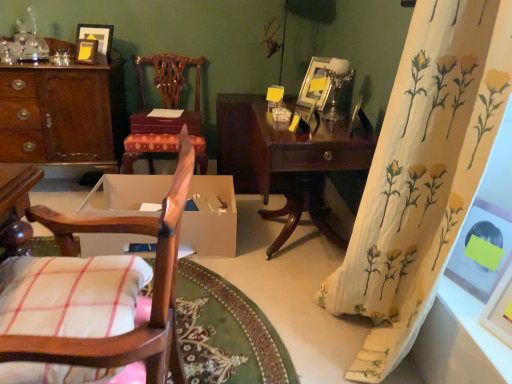
Question: Is metallic silver table lamp at upper right wider than white cotton pillow at lower left?

Choices:
 (A) no
 (B) yes

Answer: (A)

Question: Are metallic silver table lamp at upper right and white cotton pillow at lower left beside each other?

Choices:
 (A) yes
 (B) no

Answer: (B)

Question: Is metallic silver table lamp at upper right closer to the viewer compared to white cotton pillow at lower left?

Choices:
 (A) no
 (B) yes

Answer: (A)

Question: Is metallic silver table lamp at upper right outside white cotton pillow at lower left?

Choices:
 (A) no
 (B) yes

Answer: (B)

Question: Is metallic silver table lamp at upper right taller than white cotton pillow at lower left?

Choices:
 (A) no
 (B) yes

Answer: (B)

Question: From a real-world perspective, is metallic silver table lamp at upper right positioned over white cotton pillow at lower left based on gravity?

Choices:
 (A) no
 (B) yes

Answer: (B)

Question: Does metallic silver picture frame at upper right, the third picture frame viewed from the left, have a larger size compared to white floral fabric curtain at right?

Choices:
 (A) no
 (B) yes

Answer: (A)

Question: Considering the relative sizes of metallic silver picture frame at upper right, the third picture frame viewed from the left, and white floral fabric curtain at right in the image provided, is metallic silver picture frame at upper right, the third picture frame viewed from the left, thinner than white floral fabric curtain at right?

Choices:
 (A) yes
 (B) no

Answer: (A)

Question: Does metallic silver picture frame at upper right, which appears as the third picture frame when viewed from the front, come in front of white floral fabric curtain at right?

Choices:
 (A) no
 (B) yes

Answer: (A)

Question: Considering the relative sizes of metallic silver picture frame at upper right, the 3th picture frame positioned from the back, and white floral fabric curtain at right in the image provided, is metallic silver picture frame at upper right, the 3th picture frame positioned from the back, shorter than white floral fabric curtain at right?

Choices:
 (A) no
 (B) yes

Answer: (B)

Question: Does metallic silver picture frame at upper right, which appears as the third picture frame when viewed from the front, have a greater width compared to white floral fabric curtain at right?

Choices:
 (A) no
 (B) yes

Answer: (A)

Question: From a real-world perspective, is metallic silver picture frame at upper right, the third picture frame from the top, over white floral fabric curtain at right?

Choices:
 (A) yes
 (B) no

Answer: (A)

Question: Is wooden desk at left not close to matte white picture frame at right, the first picture frame when ordered from right to left?

Choices:
 (A) yes
 (B) no

Answer: (A)